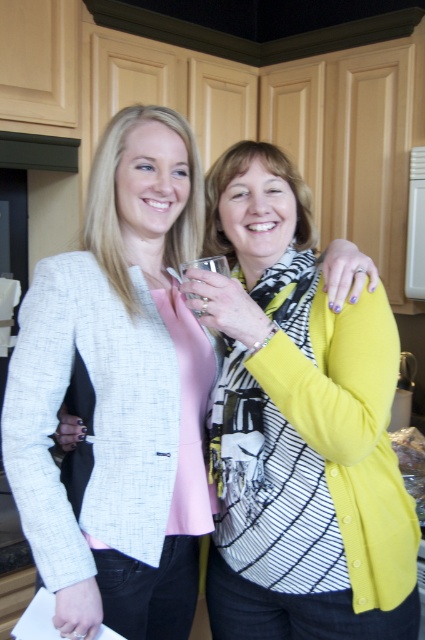
Is matte yellow cardigan at center shorter than clear glass at center?

No, matte yellow cardigan at center is not shorter than clear glass at center.

Which is more to the right, matte yellow cardigan at center or clear glass at center?

clear glass at center is more to the right.

Is point (175, 442) positioned before point (224, 275)?

No, (175, 442) is further to viewer.

Image resolution: width=425 pixels, height=640 pixels. Find the location of `matte yellow cardigan at center`. matte yellow cardigan at center is located at coordinates (119, 392).